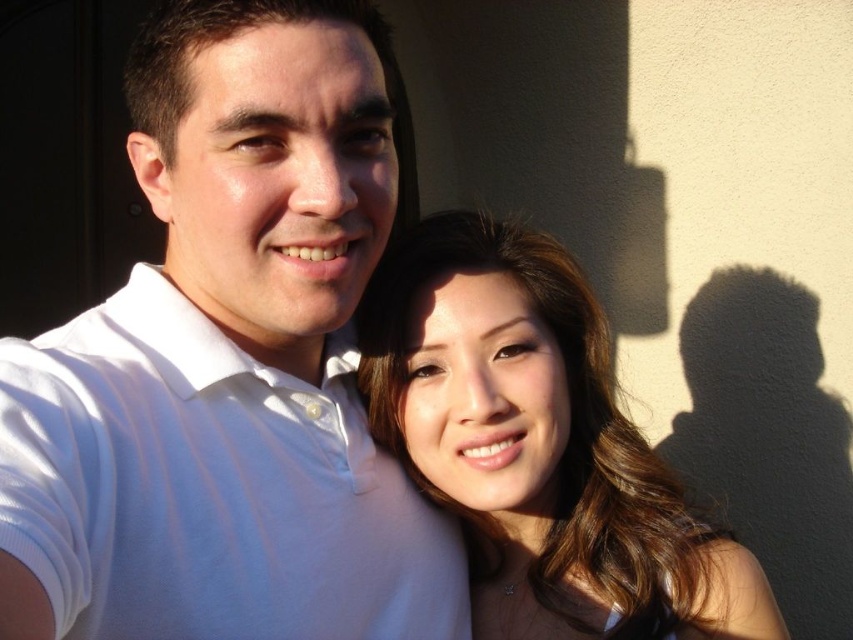
Who is more distant from viewer, (57, 554) or (637, 627)?

Point (637, 627)

Is white smooth shirt at center bigger than smooth brown hair at center?

Indeed, white smooth shirt at center has a larger size compared to smooth brown hair at center.

Between point (447, 570) and point (447, 220), which one is positioned behind?

The point (447, 220) is more distant.

Image resolution: width=853 pixels, height=640 pixels. I want to click on white smooth shirt at center, so click(x=229, y=362).